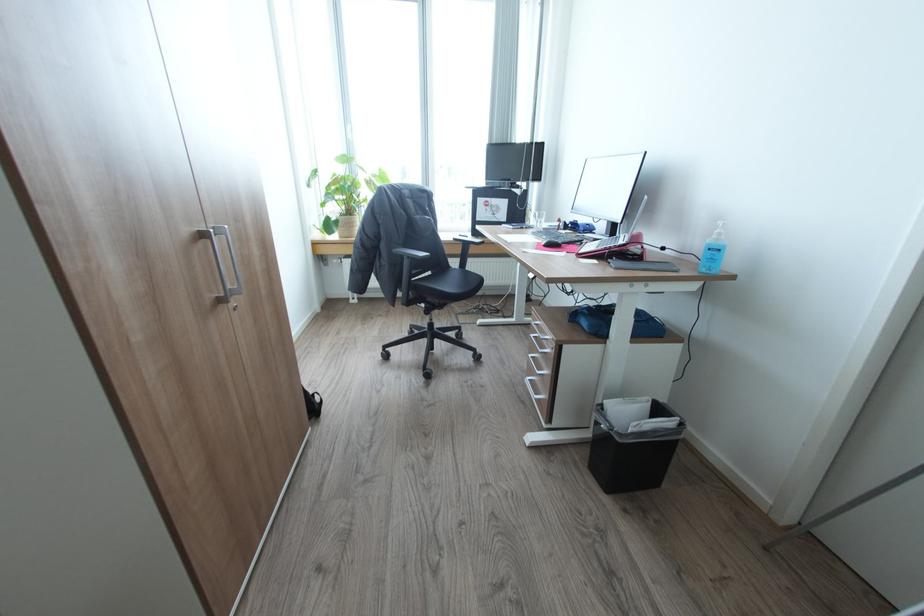
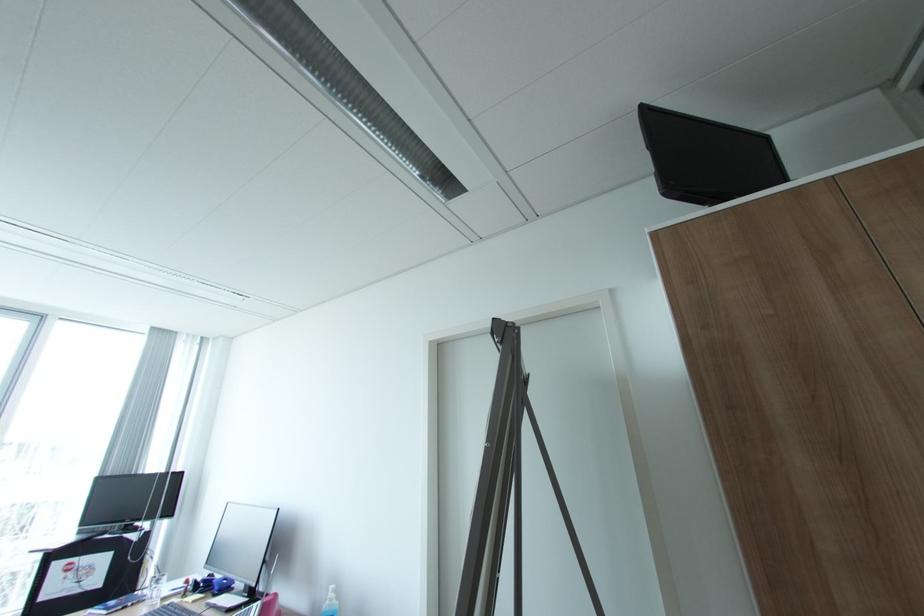
The images are taken continuously from a first-person perspective. In which direction is your viewpoint rotating?

The camera's rotation is toward right-up.